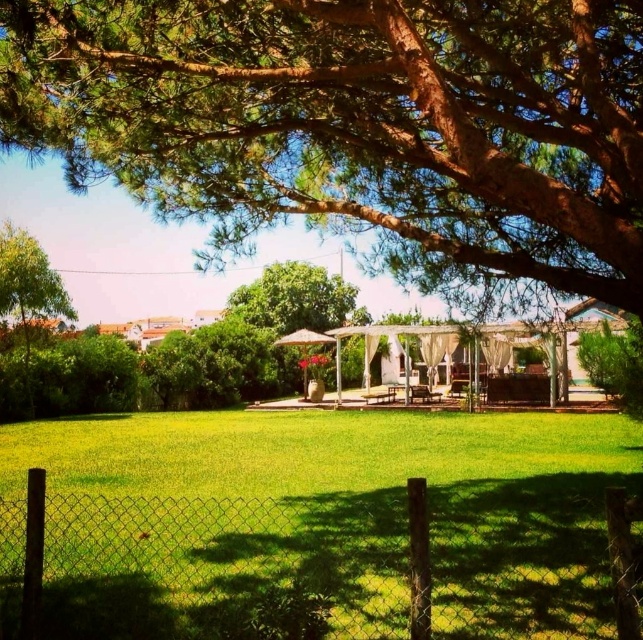
Question: Considering the real-world distances, which object is closest to the wire mesh fence at lower center?

Choices:
 (A) green leafy tree at upper center
 (B) green leafy tree at left

Answer: (A)

Question: Estimate the real-world distances between objects in this image. Which object is closer to the wire mesh fence at lower center?

Choices:
 (A) green leafy tree at left
 (B) green leafy tree at upper center

Answer: (B)

Question: Does green leafy tree at upper center appear under green leafy tree at left?

Choices:
 (A) no
 (B) yes

Answer: (A)

Question: Where is wire mesh fence at lower center located in relation to green leafy tree at left in the image?

Choices:
 (A) right
 (B) left

Answer: (A)

Question: Which object appears farthest from the camera in this image?

Choices:
 (A) wire mesh fence at lower center
 (B) green leafy tree at left

Answer: (B)

Question: From the image, what is the correct spatial relationship of wire mesh fence at lower center in relation to green leafy tree at left?

Choices:
 (A) right
 (B) left

Answer: (A)